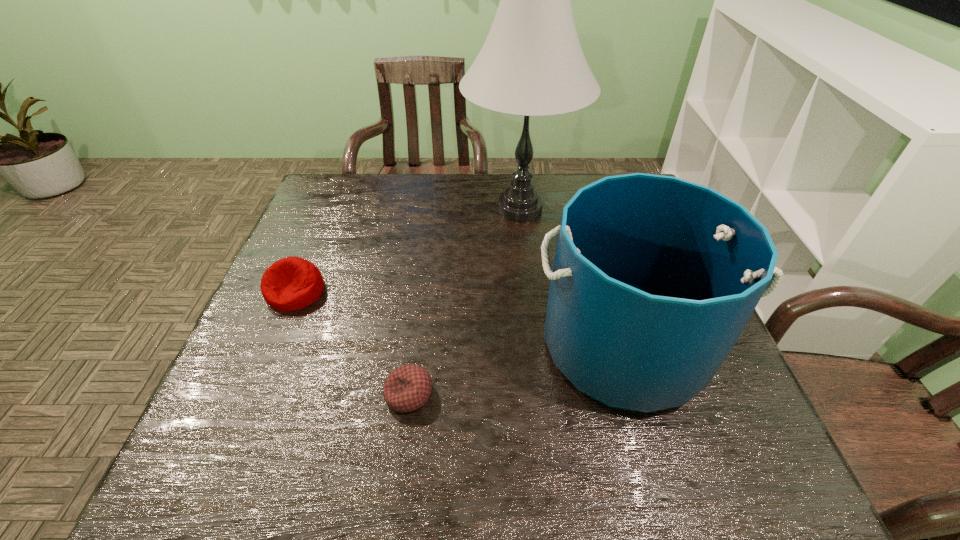
Find the location of `free space between the shorter beanbag and the taller beanbag`. free space between the shorter beanbag and the taller beanbag is located at coordinates (352, 343).

Where is `free area in between the taller beanbag and the second tallest object`? The height and width of the screenshot is (540, 960). free area in between the taller beanbag and the second tallest object is located at coordinates pos(460,319).

This screenshot has height=540, width=960. In order to click on blank region between the nearer beanbag and the bucket in this screenshot , I will do `click(516, 370)`.

You are a GUI agent. You are given a task and a screenshot of the screen. Output one action in this format:
    pyautogui.click(x=<x>, y=<y>)
    Task: Click on the empty space between the right beanbag and the lamp
    The width and height of the screenshot is (960, 540).
    Given the screenshot: What is the action you would take?
    pyautogui.click(x=465, y=301)

Identify the location of unoccupied position between the third shortest object and the nearer beanbag. (516, 370).

Locate an element on the screen. object that stands as the third closest to the nearer beanbag is located at coordinates (532, 64).

Select which object is the second closest to the farthest object. Please provide its 2D coordinates. Your answer should be formatted as a tuple, i.e. [(x, y)], where the tuple contains the x and y coordinates of a point satisfying the conditions above.

[(292, 283)]

The height and width of the screenshot is (540, 960). I want to click on vacant region that satisfies the following two spatial constraints: 1. on the back side of the shortest object; 2. on the right side of the tallest object, so click(x=433, y=208).

Where is `free space in the image that satisfies the following two spatial constraints: 1. on the seat area of the shortest object; 2. on the left side of the leftmost object`? This screenshot has width=960, height=540. free space in the image that satisfies the following two spatial constraints: 1. on the seat area of the shortest object; 2. on the left side of the leftmost object is located at coordinates (252, 394).

Identify the location of free space that satisfies the following two spatial constraints: 1. on the back side of the right beanbag; 2. on the left side of the bucket. The image size is (960, 540). (416, 346).